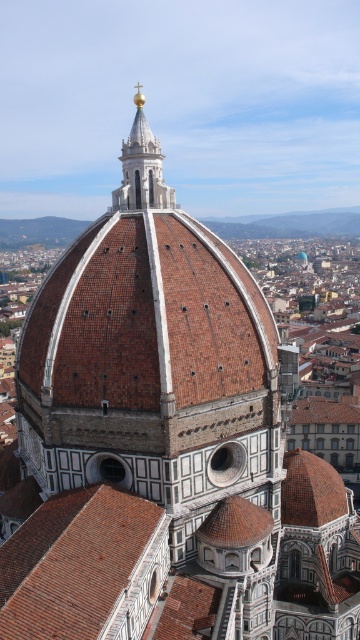
You are an architect visiting Florence Cathedral. You notice the brown tiled roof at center and the polished gold spire at upper center. Which object is taller?

The polished gold spire at upper center is taller than the brown tiled roof at center.

Looking at this image, you are an architect analyzing the Florence Cathedral. You notice the brown tiled roof at center and the polished gold spire at upper center. Which object takes up more area in the image?

The polished gold spire at upper center occupies more space than the brown tiled roof at center.